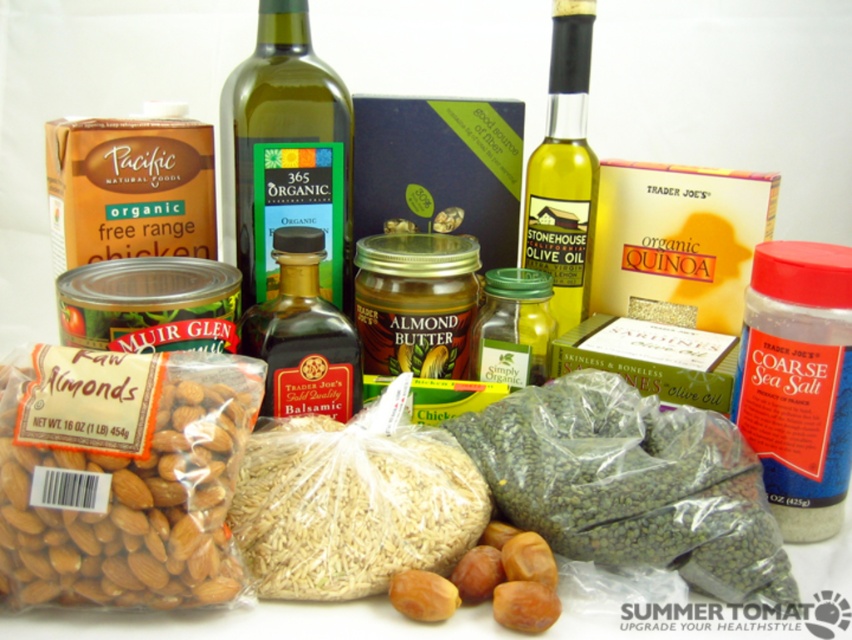
Question: Which object is closer to the camera taking this photo?

Choices:
 (A) green matte lentils at center
 (B) yellow glass bottle at center-right
 (C) green glass bottle at center
 (D) dark brown glass bottle at center

Answer: (A)

Question: Which of the following is the farthest from the observer?

Choices:
 (A) green matte lentils at center
 (B) yellow glass bottle at center-right
 (C) green glass bottle at center
 (D) brown matte raw almonds at lower left

Answer: (B)

Question: Does brown matte raw almonds at lower left appear on the right side of green matte lentils at center?

Choices:
 (A) yes
 (B) no

Answer: (B)

Question: Among these objects, which one is farthest from the camera?

Choices:
 (A) brown matte raw almonds at lower left
 (B) green glass bottle at center
 (C) dark brown glass bottle at center
 (D) green matte lentils at center

Answer: (B)

Question: Does green glass bottle at center have a greater width compared to dark brown glass bottle at center?

Choices:
 (A) yes
 (B) no

Answer: (A)

Question: Is brown matte raw almonds at lower left thinner than dark brown glass bottle at center?

Choices:
 (A) no
 (B) yes

Answer: (A)